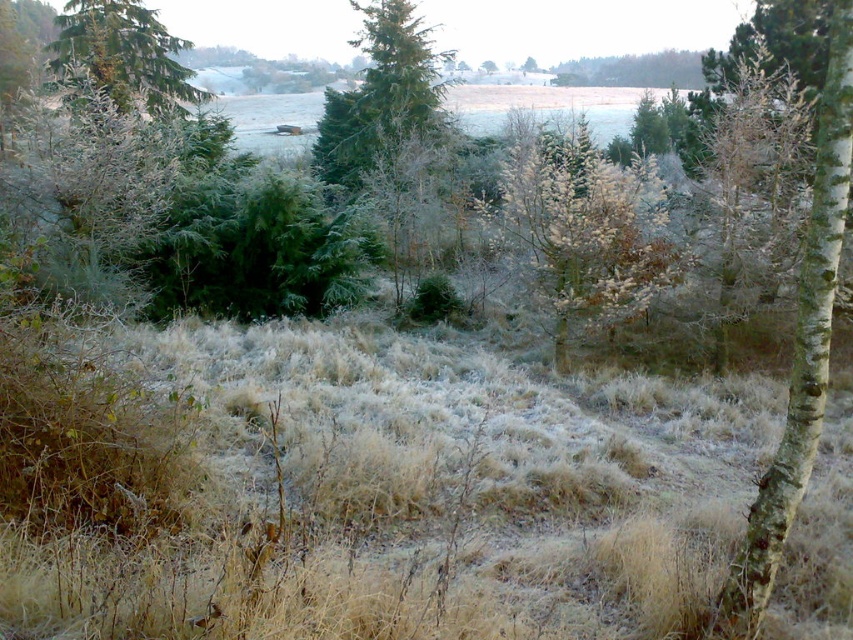
Question: Does white bark tree at right have a smaller size compared to green matte tree at upper left?

Choices:
 (A) no
 (B) yes

Answer: (B)

Question: Which object appears closest to the camera in this image?

Choices:
 (A) frosted grass at center
 (B) green matte tree at upper left
 (C) white bark tree at right

Answer: (C)

Question: Among these points, which one is farthest from the camera?

Choices:
 (A) (421, 68)
 (B) (845, 81)

Answer: (A)

Question: Can you confirm if green matte tree at center is positioned to the left of green matte tree at upper left?

Choices:
 (A) no
 (B) yes

Answer: (A)

Question: Which point is closer to the camera?

Choices:
 (A) (556, 262)
 (B) (97, 35)

Answer: (A)

Question: Is frosted grass at center in front of green matte tree at upper left?

Choices:
 (A) yes
 (B) no

Answer: (A)